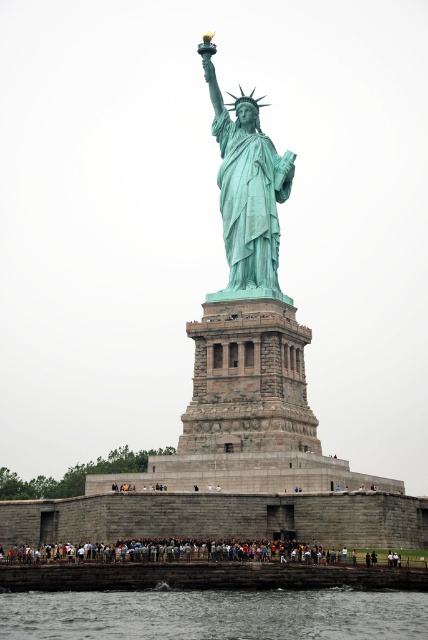
Is point (317, 614) positioned in front of point (237, 180)?

That is True.

Can you confirm if clear water at lower center is wider than green patina statue at center?

Correct, the width of clear water at lower center exceeds that of green patina statue at center.

The height and width of the screenshot is (640, 428). Find the location of `clear water at lower center`. clear water at lower center is located at coordinates (214, 614).

The width and height of the screenshot is (428, 640). What are the coordinates of `clear water at lower center` in the screenshot? It's located at (214, 614).

Between green patina statue at center and dark gray concrete crowd at lower center, which one is positioned higher?

green patina statue at center is higher up.

Describe the element at coordinates (246, 189) in the screenshot. The height and width of the screenshot is (640, 428). I see `green patina statue at center` at that location.

This screenshot has height=640, width=428. In order to click on green patina statue at center in this screenshot , I will do `click(246, 189)`.

I want to click on clear water at lower center, so click(214, 614).

Is clear water at lower center positioned at the back of dark gray concrete crowd at lower center?

No, it is in front of dark gray concrete crowd at lower center.

Where is `clear water at lower center`? This screenshot has height=640, width=428. clear water at lower center is located at coordinates (214, 614).

Where is `clear water at lower center`? clear water at lower center is located at coordinates (214, 614).